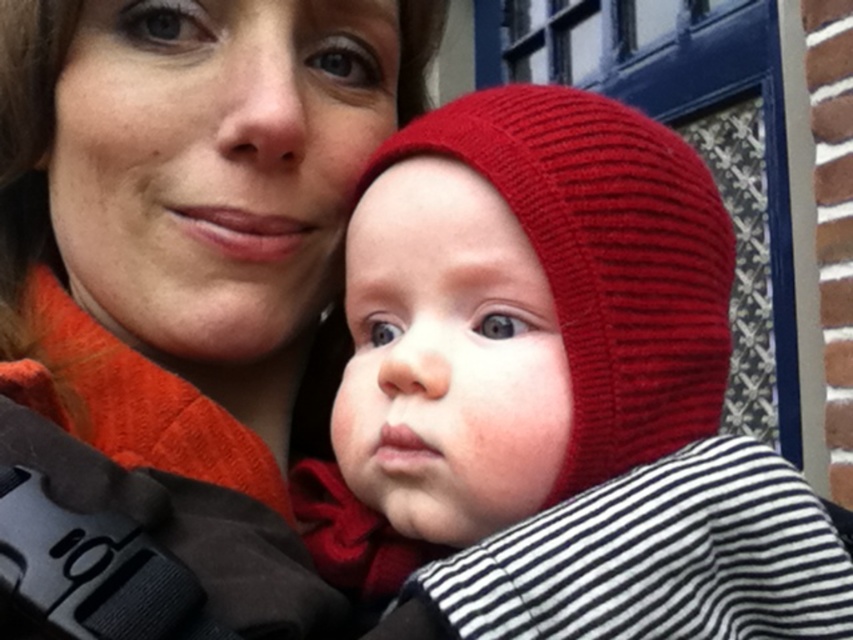
Can you confirm if matte orange sweater at upper left is taller than knitted red hat at center?

Yes.

Is matte orange sweater at upper left above knitted red hat at center?

Yes, matte orange sweater at upper left is above knitted red hat at center.

Locate an element on the screen. This screenshot has width=853, height=640. matte orange sweater at upper left is located at coordinates (177, 298).